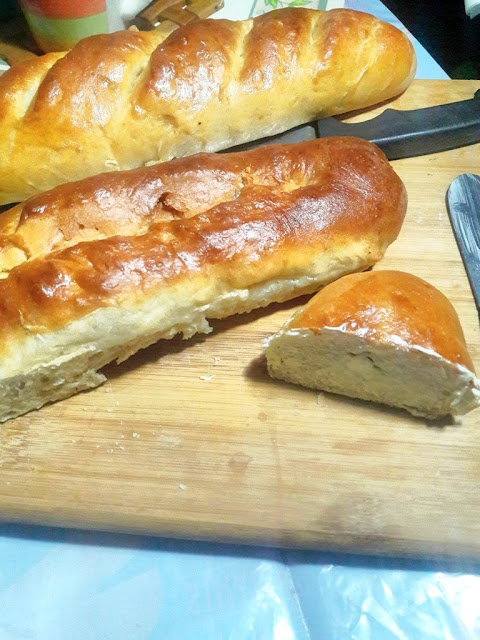
Identify the location of chopping board. (252, 445).